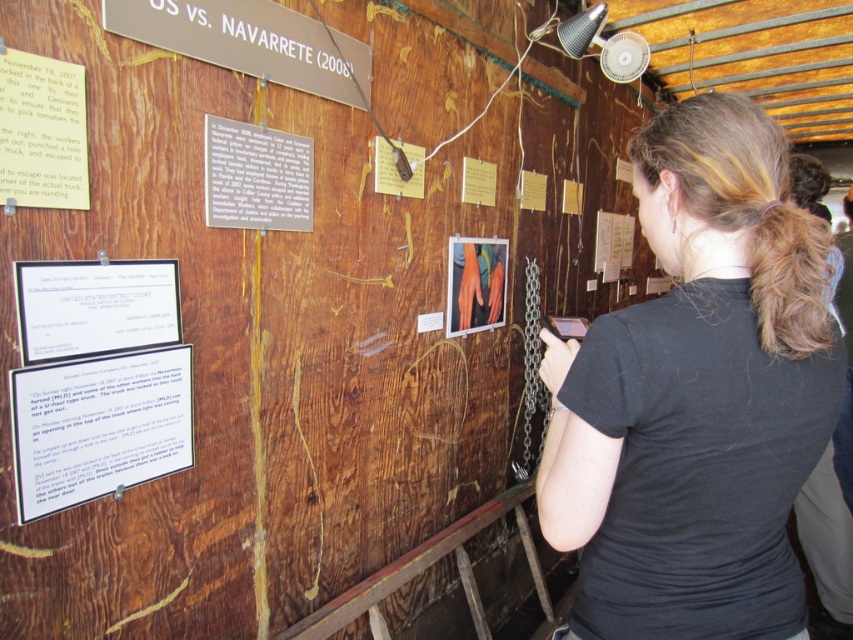
You are an office assistant who needs to retrieve the white paper at left and the blonde curly hair at upper right. Which object is closer to you on the wall?

The white paper at left is closer to you because it is further to the viewer than the blonde curly hair at upper right, meaning it appears nearer in the displayed wall arrangement.

You are an interior designer arranging items on a rustic wooden wall. You have a matte brown paper at upper left and a wooden sign at upper center. Which object is closer to the viewer?

The wooden sign at upper center is closer to the viewer because the matte brown paper at upper left is behind it.

You are an interior designer assessing the placement of items on the wooden wall display. The wooden sign at upper center and the matte orange gloves at center are both important elements. Which object is positioned closer to the front of the display?

The wooden sign at upper center is closer to the viewer than the matte orange gloves at center, so it is positioned closer to the front of the display.